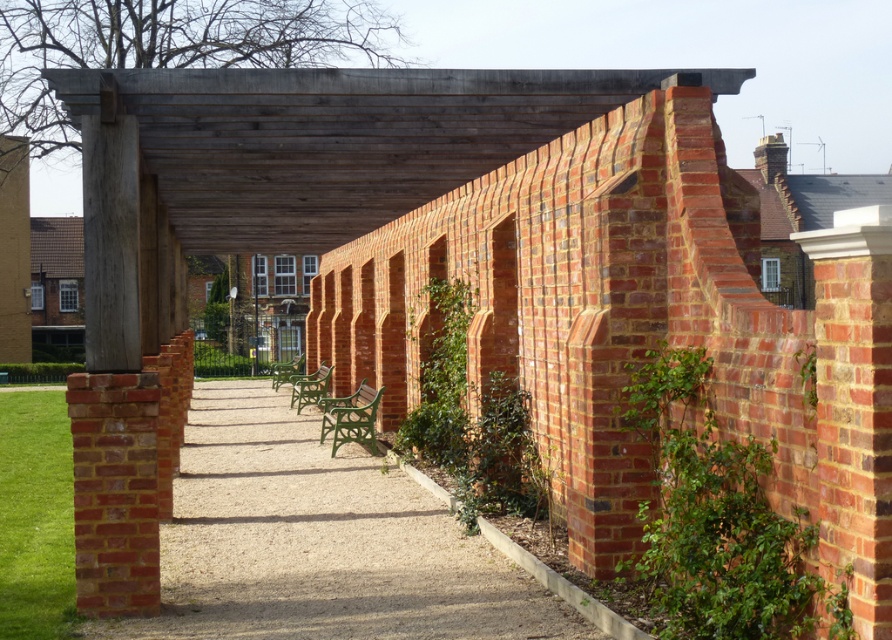
Between red brick path at center and red brick wall at left, which one has more height?

With more height is red brick wall at left.

Is red brick path at center to the right of red brick wall at left from the viewer's perspective?

Incorrect, red brick path at center is not on the right side of red brick wall at left.

Does point (450, 560) lie in front of point (146, 573)?

No, (450, 560) is further to viewer.

Identify the location of red brick path at center. (321, 541).